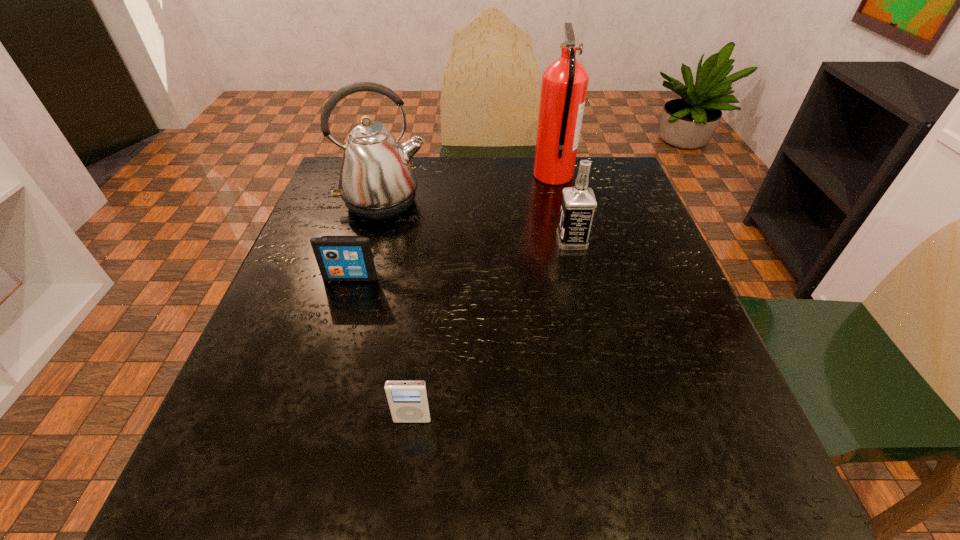
At what (x,y) coordinates should I click in order to perform the action: click on the tallest object. Please return your answer as a coordinate pair (x, y). The image size is (960, 540). Looking at the image, I should click on (564, 85).

This screenshot has height=540, width=960. Identify the location of kettle. (376, 182).

Find the location of `the third nearest object`. the third nearest object is located at coordinates click(x=578, y=204).

Locate an element on the screen. The height and width of the screenshot is (540, 960). vodka is located at coordinates (578, 204).

Where is `the left iPod`? This screenshot has width=960, height=540. the left iPod is located at coordinates (340, 258).

You are a GUI agent. You are given a task and a screenshot of the screen. Output one action in this format:
    pyautogui.click(x=<x>, y=<y>)
    Task: Click on the fourth farthest object
    The height and width of the screenshot is (540, 960).
    Given the screenshot: What is the action you would take?
    pyautogui.click(x=340, y=258)

You are a GUI agent. You are given a task and a screenshot of the screen. Output one action in this format:
    pyautogui.click(x=<x>, y=<y>)
    Task: Click on the nearest object
    The image size is (960, 540).
    Given the screenshot: What is the action you would take?
    pyautogui.click(x=408, y=401)

At what (x,y) coordinates should I click in order to perform the action: click on the nearer iPod. Please return your answer as a coordinate pair (x, y). This screenshot has width=960, height=540. Looking at the image, I should click on (408, 401).

This screenshot has width=960, height=540. I want to click on free space located at the nozzle of the fire extinguisher, so click(413, 176).

This screenshot has width=960, height=540. Find the location of `free space located at the nozzle of the fire extinguisher`. free space located at the nozzle of the fire extinguisher is located at coordinates (420, 176).